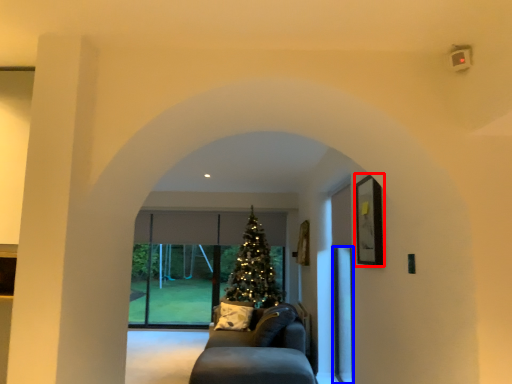
Question: Which object appears farthest to the camera in this image, picture frame (highlighted by a red box) or screen door (highlighted by a blue box)?

Choices:
 (A) picture frame
 (B) screen door

Answer: (B)